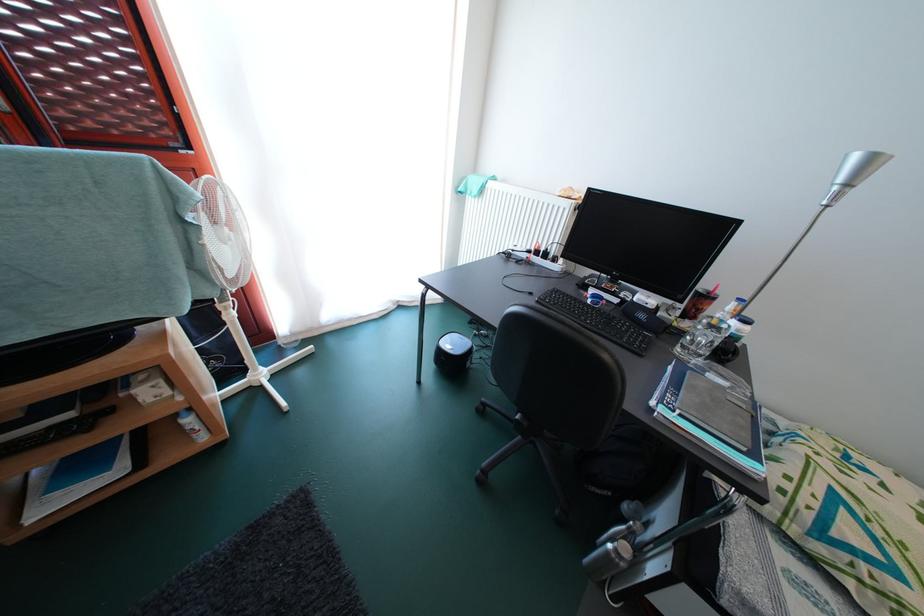
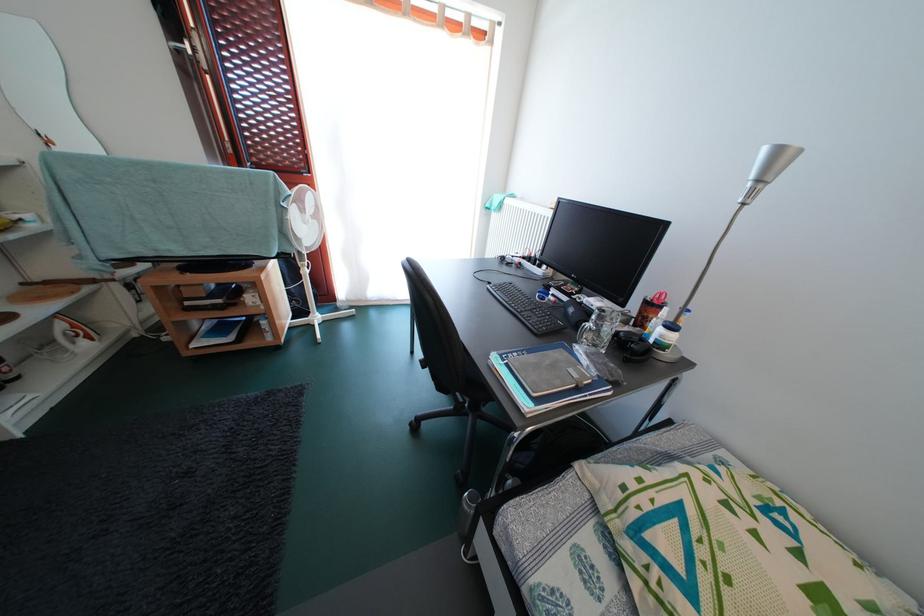
Find the pixel in the second image that matches pixel 710 361 in the first image.

(602, 351)